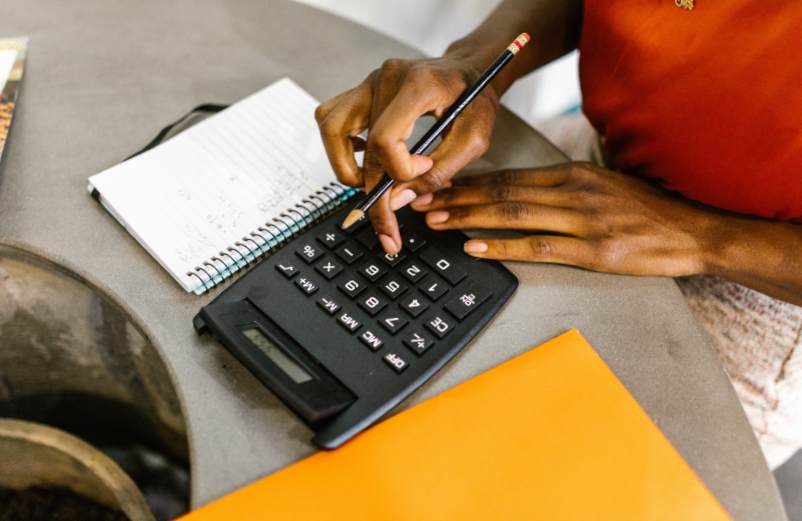
You are a GUI agent. You are given a task and a screenshot of the screen. Output one action in this format:
    pyautogui.click(x=<x>, y=<y>)
    Task: Click on the folder
    The width and height of the screenshot is (802, 521).
    Given the screenshot: What is the action you would take?
    pyautogui.click(x=540, y=454)